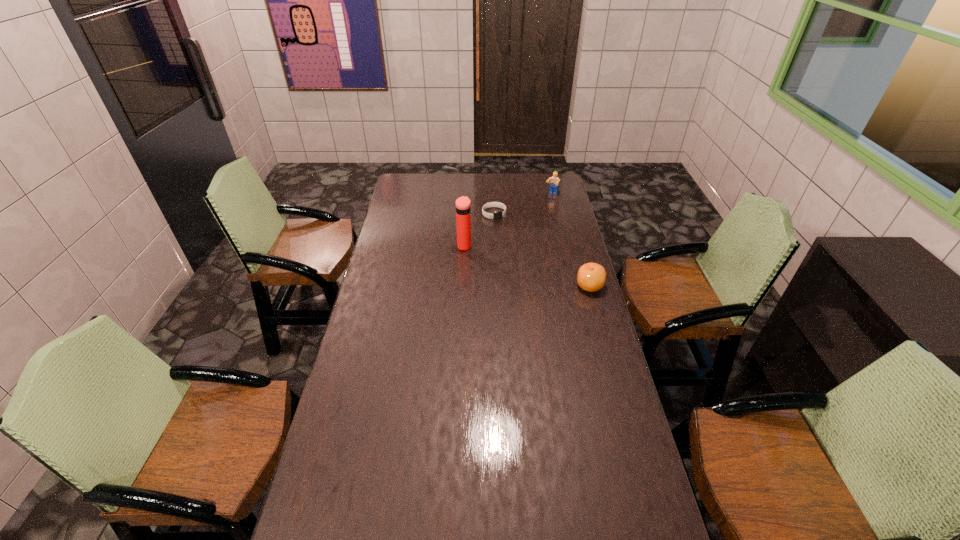
At what (x,y) coordinates should I click in order to perform the action: click on vacant area at the far edge of the desktop. Please return your answer as a coordinate pair (x, y). The width and height of the screenshot is (960, 540). Looking at the image, I should click on (528, 177).

The height and width of the screenshot is (540, 960). I want to click on vacant space at the left edge of the desktop, so click(379, 323).

The width and height of the screenshot is (960, 540). I want to click on vacant region at the right edge of the desktop, so click(x=556, y=308).

Locate an element on the screen. Image resolution: width=960 pixels, height=540 pixels. free space at the near right corner of the desktop is located at coordinates (652, 531).

Image resolution: width=960 pixels, height=540 pixels. Find the location of `vacant point located between the clementine and the second farthest object`. vacant point located between the clementine and the second farthest object is located at coordinates (542, 250).

The height and width of the screenshot is (540, 960). I want to click on unoccupied position between the Lego and the second shortest object, so click(571, 240).

You are a GUI agent. You are given a task and a screenshot of the screen. Output one action in this format:
    pyautogui.click(x=<x>, y=<y>)
    Task: Click on the free space between the shortest object and the thermos bottle
    
    Given the screenshot: What is the action you would take?
    pyautogui.click(x=479, y=230)

Where is `vacant area between the second nearest object and the nearest object`? Image resolution: width=960 pixels, height=540 pixels. vacant area between the second nearest object and the nearest object is located at coordinates (527, 266).

This screenshot has height=540, width=960. Identify the location of free spot between the third nearest object and the second tallest object. (523, 204).

Where is `free space that is in between the wristband and the Lego`? free space that is in between the wristband and the Lego is located at coordinates (523, 204).